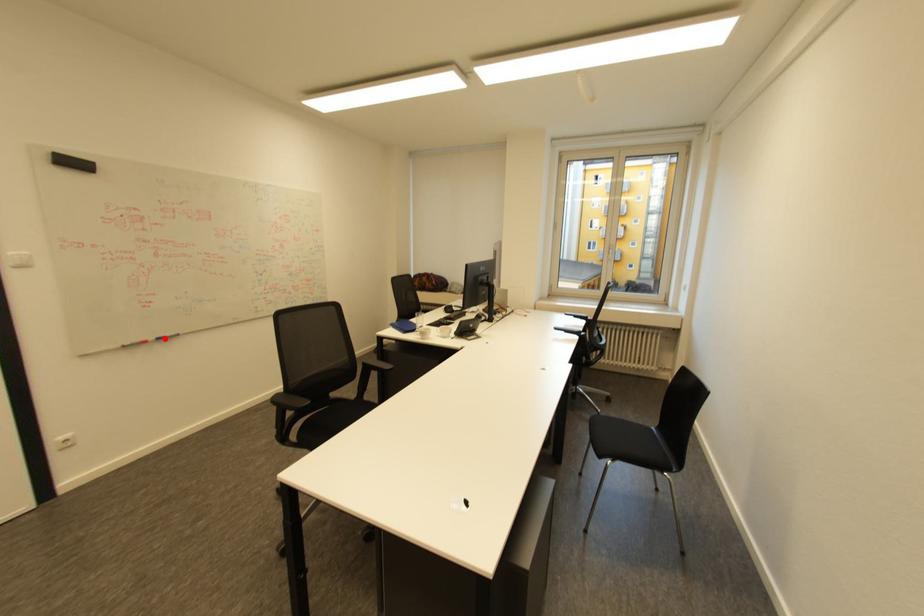
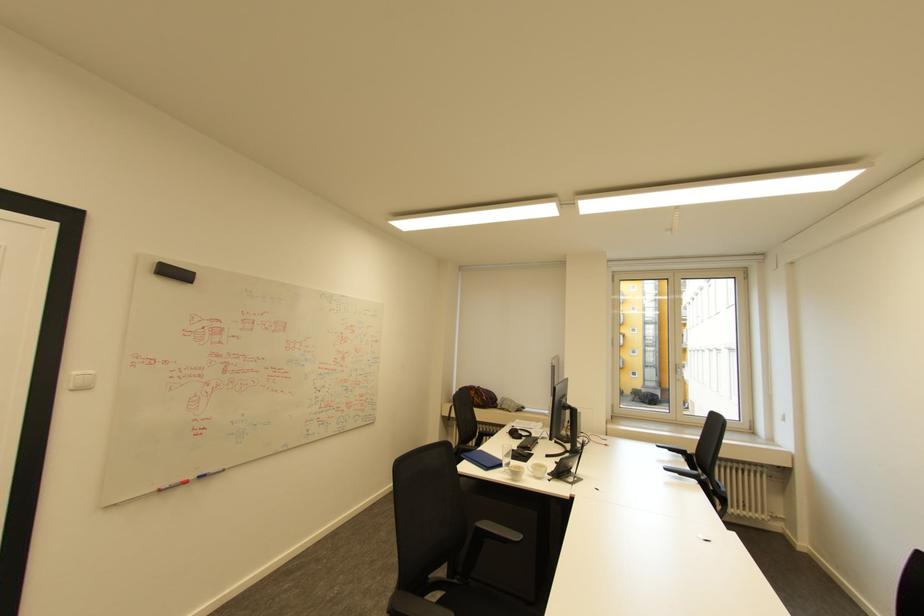
In the second image, find the point that corresponds to the highlighted location in the first image.

(207, 477)